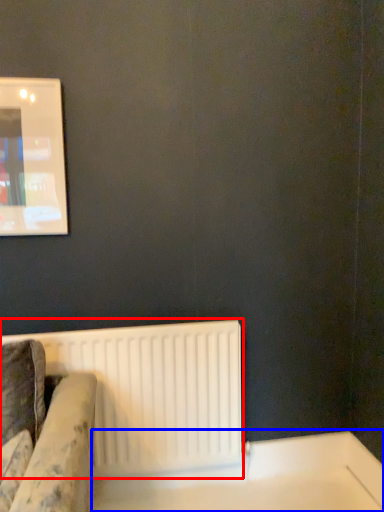
Question: Which object appears farthest to the camera in this image, radiator (highlighted by a red box) or table (highlighted by a blue box)?

Choices:
 (A) radiator
 (B) table

Answer: (A)